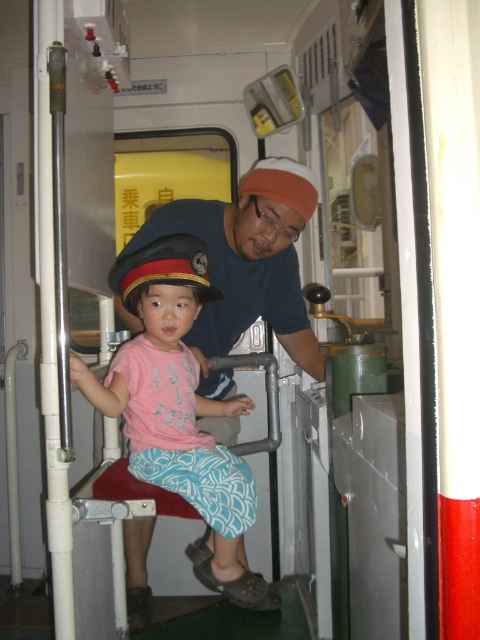
You are a passenger on the train and you see the pink fabric shirt at center and the black felt hat at center. Which object is positioned to the right?

The pink fabric shirt at center is positioned to the right of the black felt hat at center.

From the picture: You are a tailor who needs to determine if a small storage box can fit both the pink fabric shirt at center and the black felt hat at center. The box has a capacity that can only accommodate one of them. Which item should you prioritize placing in the box based on their sizes?

The pink fabric shirt at center is bigger than the black felt hat at center, so you should prioritize placing the pink fabric shirt at center in the box since it requires more space.